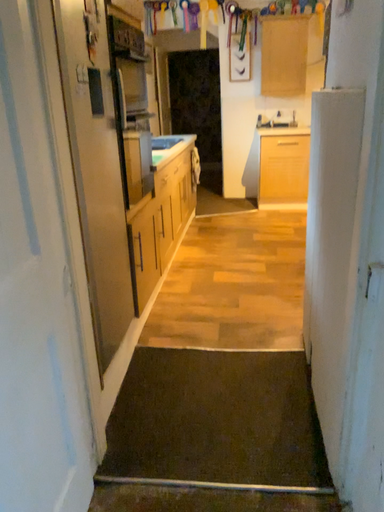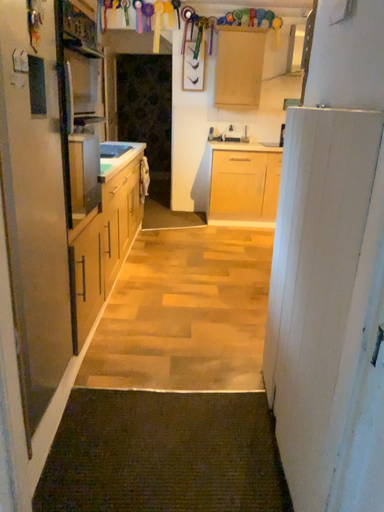
Question: Which way did the camera rotate in the video?

Choices:
 (A) rotated right
 (B) rotated left

Answer: (A)